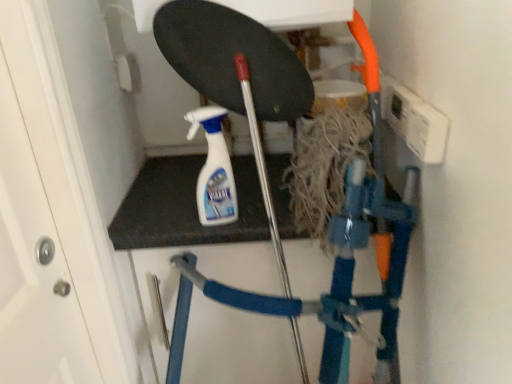
Question: Can blue plastic ladder at center be found inside white plastic spray bottle at center?

Choices:
 (A) yes
 (B) no

Answer: (B)

Question: From a real-world perspective, does white plastic spray bottle at center stand above blue plastic ladder at center?

Choices:
 (A) yes
 (B) no

Answer: (A)

Question: Can you confirm if white plastic spray bottle at center is bigger than blue plastic ladder at center?

Choices:
 (A) yes
 (B) no

Answer: (B)

Question: Can you confirm if white plastic spray bottle at center is wider than blue plastic ladder at center?

Choices:
 (A) yes
 (B) no

Answer: (B)

Question: Is white plastic spray bottle at center shorter than blue plastic ladder at center?

Choices:
 (A) no
 (B) yes

Answer: (B)

Question: From the image's perspective, is white plastic spray bottle at center located above blue plastic ladder at center?

Choices:
 (A) yes
 (B) no

Answer: (A)

Question: Could you tell me if blue plastic ladder at center is turned towards white plastic spray bottle at center?

Choices:
 (A) no
 (B) yes

Answer: (A)

Question: Would you say blue plastic ladder at center is outside white plastic spray bottle at center?

Choices:
 (A) no
 (B) yes

Answer: (B)

Question: Can you confirm if blue plastic ladder at center is bigger than white plastic spray bottle at center?

Choices:
 (A) yes
 (B) no

Answer: (A)

Question: Can you confirm if blue plastic ladder at center is shorter than white plastic spray bottle at center?

Choices:
 (A) no
 (B) yes

Answer: (A)

Question: Does blue plastic ladder at center have a greater width compared to white plastic spray bottle at center?

Choices:
 (A) no
 (B) yes

Answer: (B)

Question: Is blue plastic ladder at center behind white plastic spray bottle at center?

Choices:
 (A) yes
 (B) no

Answer: (A)

Question: From a real-world perspective, is white plastic spray bottle at center above or below blue plastic ladder at center?

Choices:
 (A) above
 (B) below

Answer: (A)